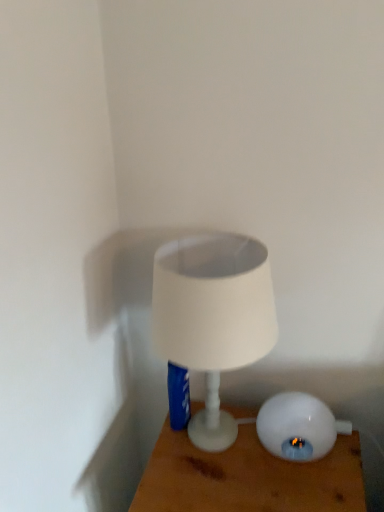
Question: From the image's perspective, relative to white matte lampshade at center, the 2th lamp when ordered from right to left, is white glossy lamp at lower right, the second lamp from the left, above or below?

Choices:
 (A) below
 (B) above

Answer: (A)

Question: In terms of size, does white glossy lamp at lower right, the first lamp in the right-to-left sequence, appear bigger or smaller than white matte lampshade at center, acting as the first lamp starting from the left?

Choices:
 (A) big
 (B) small

Answer: (B)

Question: Which object is the closest to the white glossy lamp at lower right, the first lamp in the right-to-left sequence?

Choices:
 (A) white matte lampshade at center, the 2th lamp when ordered from right to left
 (B) white glossy lamp at center

Answer: (B)

Question: Estimate the real-world distances between objects in this image. Which object is farther from the white glossy lamp at center?

Choices:
 (A) white glossy lamp at lower right, the first lamp in the right-to-left sequence
 (B) white matte lampshade at center, the 2th lamp when ordered from right to left

Answer: (B)